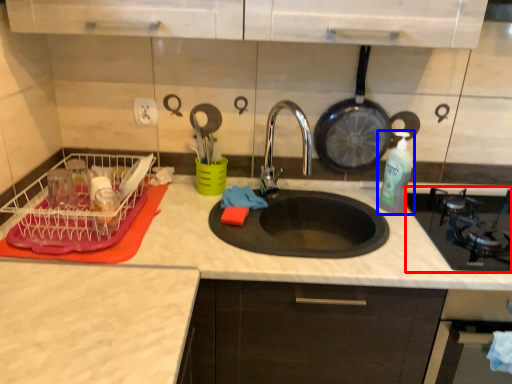
Question: Among these objects, which one is nearest to the camera, gas stove (highlighted by a red box) or bottle (highlighted by a blue box)?

Choices:
 (A) gas stove
 (B) bottle

Answer: (A)